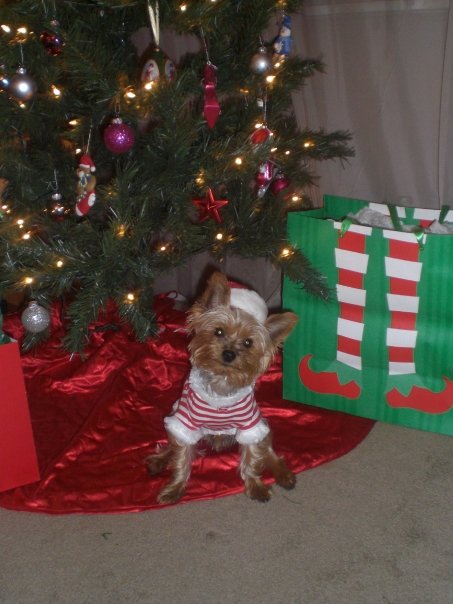
Locate an element on the screen. christmas tree is located at coordinates (117, 257).